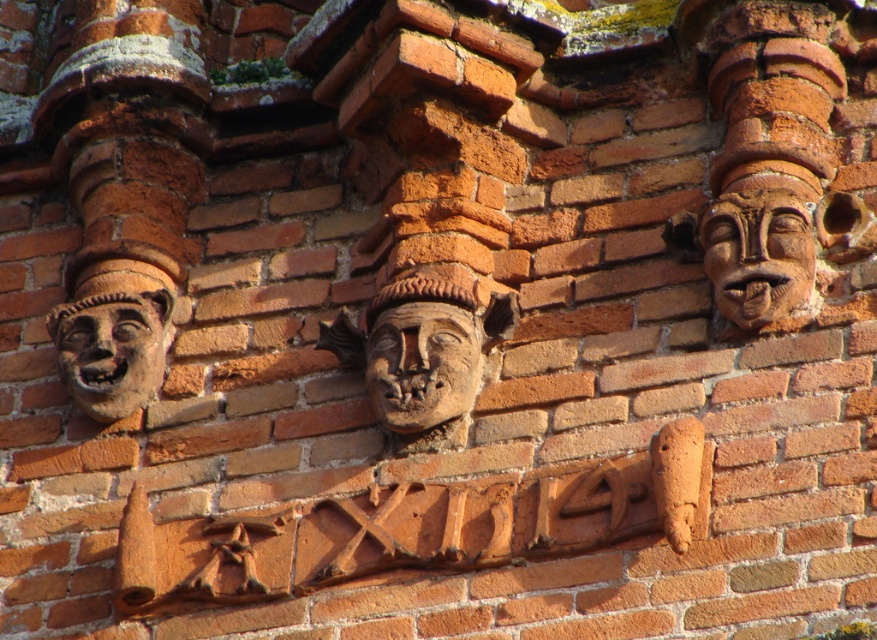
Does brown stone face at center have a smaller size compared to matte terracotta face at right?

No, brown stone face at center is not smaller than matte terracotta face at right.

Which is below, brown stone face at center or matte terracotta face at right?

brown stone face at center is lower down.

This screenshot has height=640, width=877. I want to click on brown stone face at center, so click(422, 355).

Image resolution: width=877 pixels, height=640 pixels. I want to click on matte terracotta face at right, so click(757, 253).

Looking at this image, is matte terracotta face at right positioned at the back of matte terracotta face at left?

No.

What do you see at coordinates (757, 253) in the screenshot?
I see `matte terracotta face at right` at bounding box center [757, 253].

The height and width of the screenshot is (640, 877). I want to click on matte terracotta face at right, so click(757, 253).

Based on the photo, does matte terracotta face at center have a smaller size compared to matte terracotta face at left?

Incorrect, matte terracotta face at center is not smaller in size than matte terracotta face at left.

This screenshot has height=640, width=877. What are the coordinates of `matte terracotta face at center` in the screenshot? It's located at (422, 364).

Describe the element at coordinates (422, 364) in the screenshot. I see `matte terracotta face at center` at that location.

I want to click on matte terracotta face at center, so click(x=422, y=364).